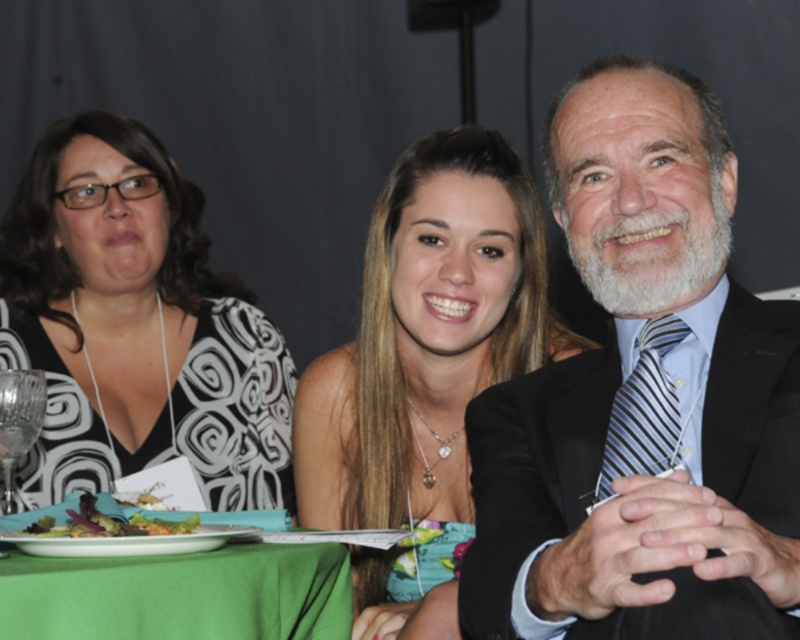
You are a photographer at this event and want to position a light source to the right of the black printed dress at left and the white glossy plate at lower left. Will the light be to the right of both objects?

The black printed dress at left is to the left of the white glossy plate at lower left. Therefore, positioning the light to the right of both objects would place it to the right of the white glossy plate at lower left, which is already to the right of the black printed dress at left. So yes, the light will be to the right of both the black printed dress at left and the white glossy plate at lower left.

You are a photographer at a social event. You need to capture a photo of the smooth brown hair at center and the white glossy plate at lower left. Can you focus on both objects at the same time?

The white glossy plate at lower left is behind the smooth brown hair at center, so focusing on both at the same time may be challenging due to their different distances from the camera.

Based on the scene description, can you determine if the dark blue suit at right is positioned higher than the smooth brown hair at center?

The dark blue suit at right is above smooth brown hair at center, so yes, it is positioned higher.